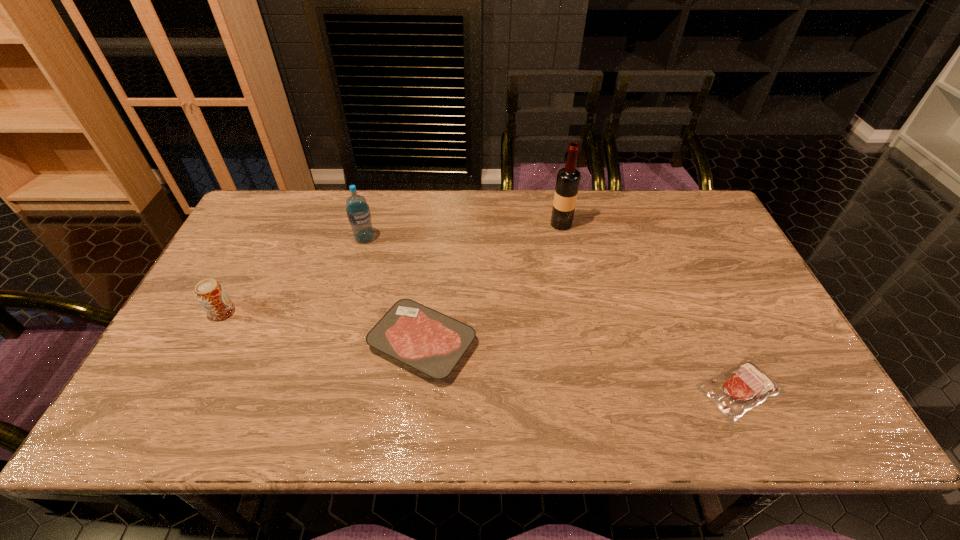
Identify the location of vacant area that lies between the fourth object from left to right and the third shortest object. The width and height of the screenshot is (960, 540). (392, 268).

Identify the location of free space between the water bottle and the left steak. (394, 291).

Image resolution: width=960 pixels, height=540 pixels. Identify the location of unoccupied area between the tallest object and the right steak. (651, 306).

Find the location of a particular element. The image size is (960, 540). vacant point located between the taller steak and the second object from right to left is located at coordinates (492, 284).

Where is `free space between the second farthest object and the farthest object`? free space between the second farthest object and the farthest object is located at coordinates [463, 231].

Locate an element on the screen. empty location between the farthest object and the leftmost object is located at coordinates (392, 268).

You are a GUI agent. You are given a task and a screenshot of the screen. Output one action in this format:
    pyautogui.click(x=<x>, y=<y>)
    Task: Click on the second closest object to the shortest object
    Image resolution: width=960 pixels, height=540 pixels.
    Given the screenshot: What is the action you would take?
    pyautogui.click(x=568, y=179)

Find the location of `object that is the third closest to the tallest object`. object that is the third closest to the tallest object is located at coordinates point(358,212).

Locate an element on the screen. free space that satisfies the following two spatial constraints: 1. on the back side of the tallest object; 2. on the left side of the second object from left to right is located at coordinates (369, 224).